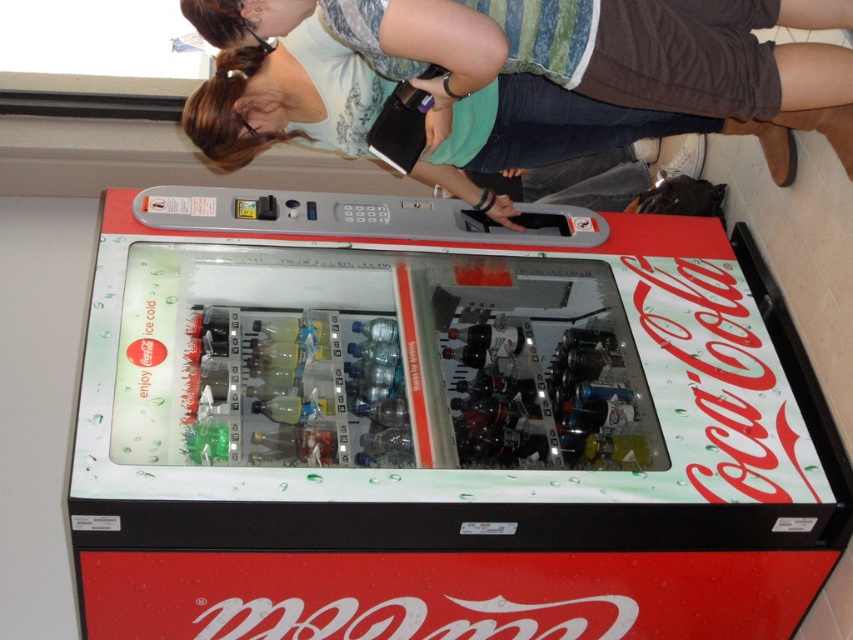
Question: Does metallic silver vending machine at center have a lesser width compared to matte green shirt at upper center?

Choices:
 (A) no
 (B) yes

Answer: (A)

Question: Is metallic silver vending machine at center to the left of matte green shirt at upper center from the viewer's perspective?

Choices:
 (A) no
 (B) yes

Answer: (B)

Question: Which point is closer to the camera taking this photo?

Choices:
 (A) [x=447, y=288]
 (B) [x=811, y=65]

Answer: (B)

Question: Is metallic silver vending machine at center smaller than matte green shirt at upper center?

Choices:
 (A) no
 (B) yes

Answer: (A)

Question: Which point is farther to the camera?

Choices:
 (A) metallic silver vending machine at center
 (B) matte green shirt at upper center

Answer: (B)